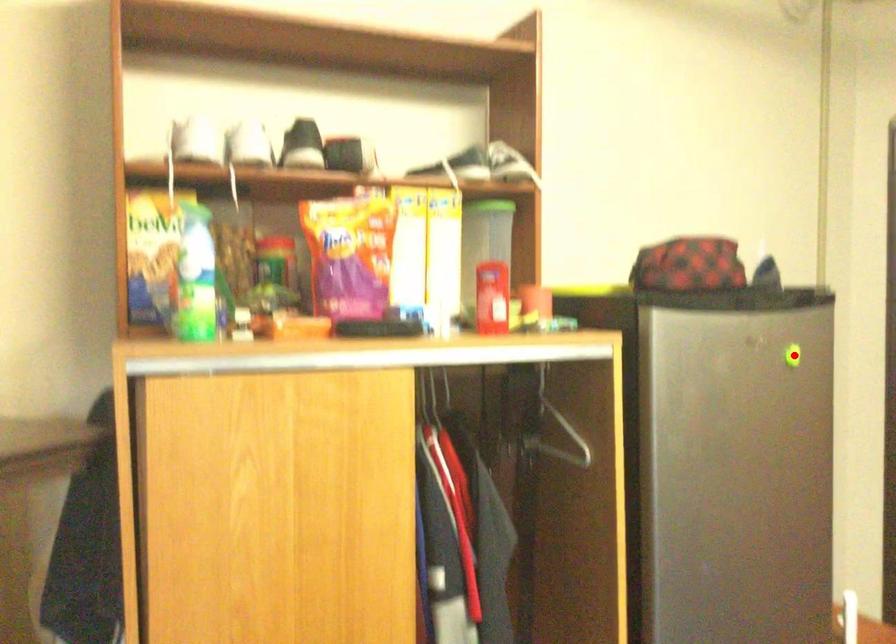
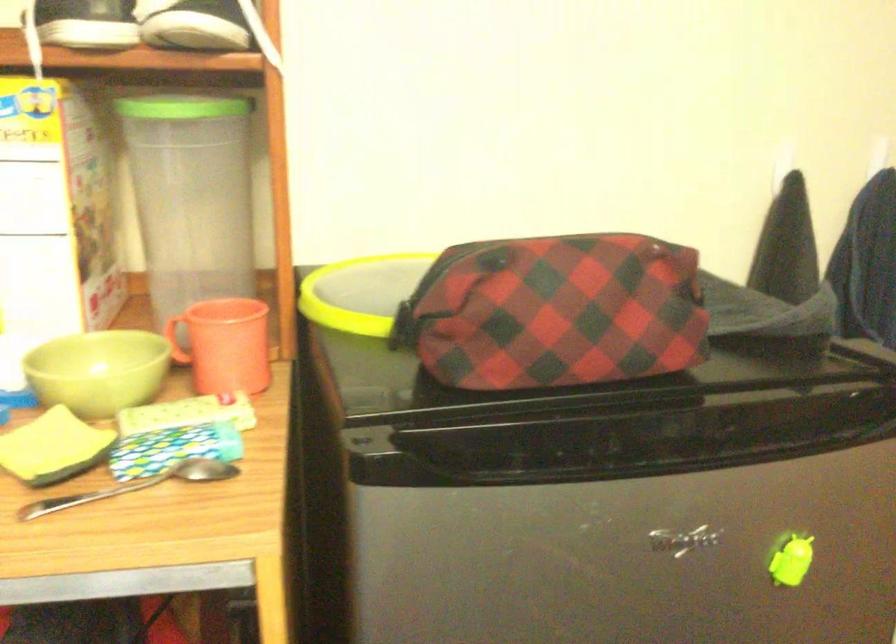
The point at the highlighted location is marked in the first image. Where is the corresponding point in the second image?

(791, 560)